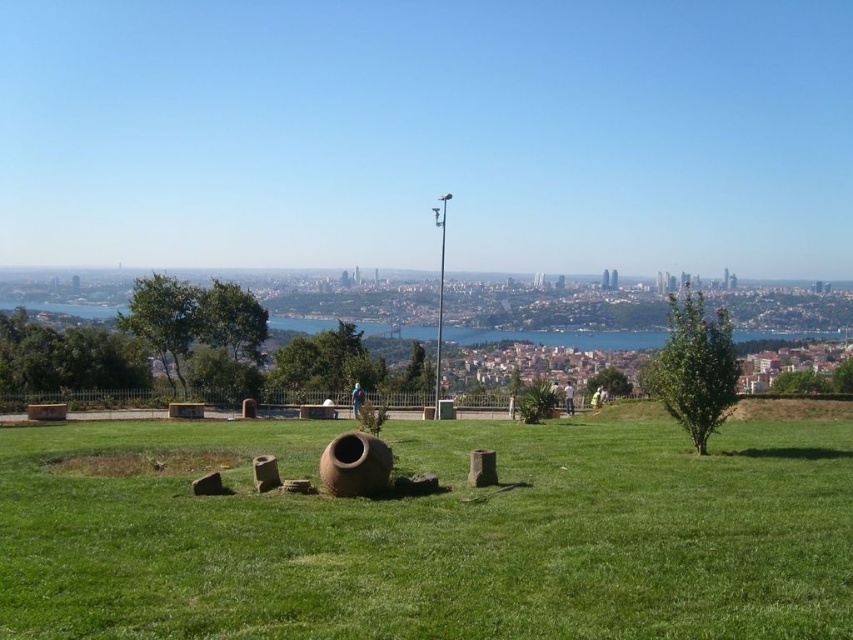
Question: Which object is farther from the camera taking this photo?

Choices:
 (A) green grassy at center
 (B) blue fabric person at center

Answer: (B)

Question: Is green grassy at center bigger than blue fabric person at center?

Choices:
 (A) yes
 (B) no

Answer: (A)

Question: Does green grassy at center appear over blue fabric person at center?

Choices:
 (A) no
 (B) yes

Answer: (B)

Question: Which point is farther from the camera taking this photo?

Choices:
 (A) (361, 401)
 (B) (637, 628)

Answer: (A)

Question: Can you confirm if green grassy at center is positioned to the left of blue fabric person at center?

Choices:
 (A) yes
 (B) no

Answer: (B)

Question: Which point is farther to the camera?

Choices:
 (A) green grassy at center
 (B) blue fabric person at center

Answer: (B)